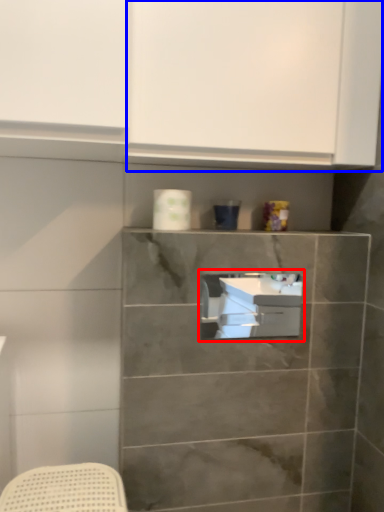
Question: Which object appears farthest to the camera in this image, sink (highlighted by a red box) or cabinetry (highlighted by a blue box)?

Choices:
 (A) sink
 (B) cabinetry

Answer: (A)